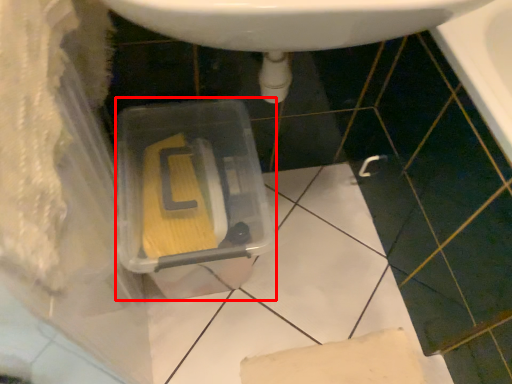
Question: Observing the image, what is the correct spatial positioning of storage box (annotated by the red box) in reference to sink?

Choices:
 (A) right
 (B) left

Answer: (B)